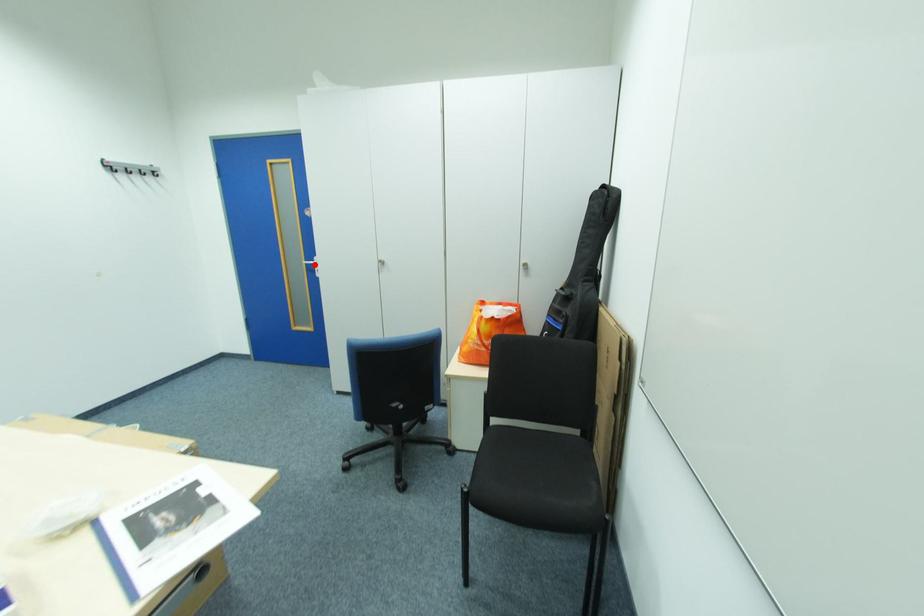
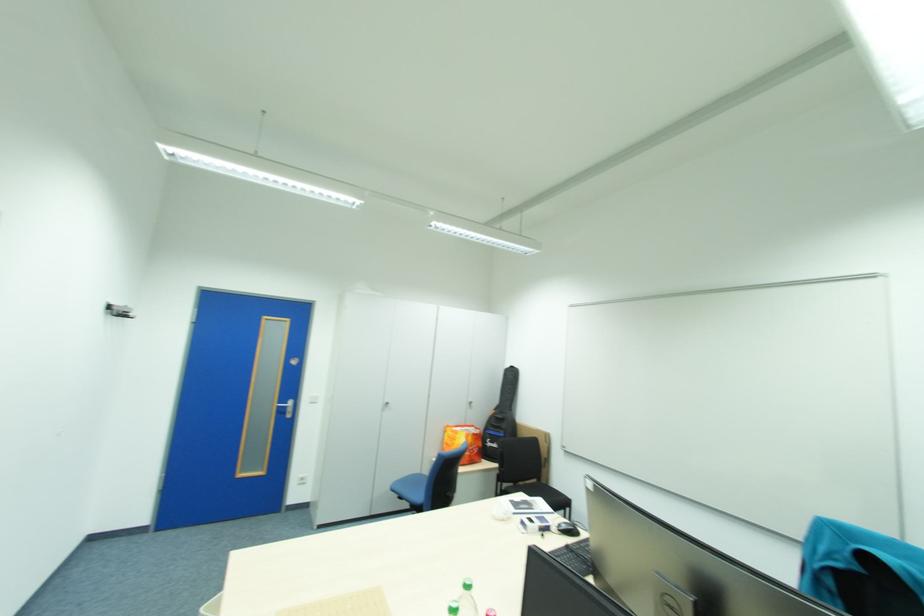
Question: I am providing you with two images of the same scene from different viewpoints. A red point is shown in image1. For the corresponding object point in image2, is it positioned nearer or farther from the camera?

Choices:
 (A) Nearer
 (B) Farther

Answer: (B)